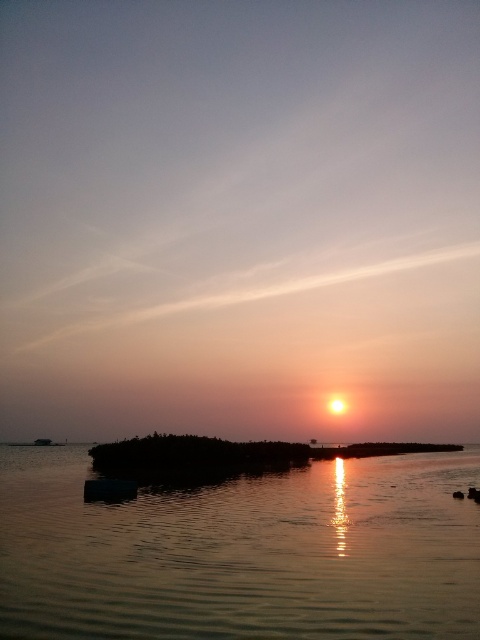
Question: Which point is closer to the camera?

Choices:
 (A) (93, 456)
 (B) (110, 545)

Answer: (B)

Question: Does silvery reflective water at center appear on the right side of silky sand at center?

Choices:
 (A) yes
 (B) no

Answer: (B)

Question: Is silvery reflective water at center positioned before silky sand at center?

Choices:
 (A) yes
 (B) no

Answer: (A)

Question: Can you confirm if silvery reflective water at center is thinner than silky sand at center?

Choices:
 (A) yes
 (B) no

Answer: (A)

Question: Among these objects, which one is farthest from the camera?

Choices:
 (A) silky sand at center
 (B) silvery reflective water at center

Answer: (A)